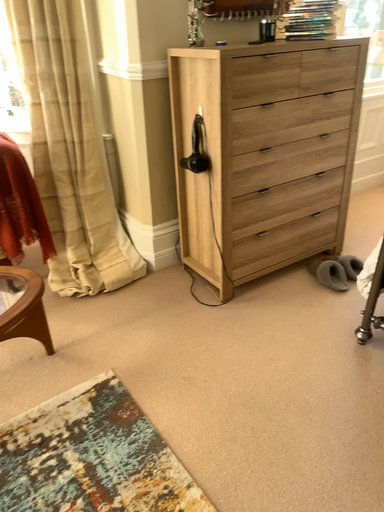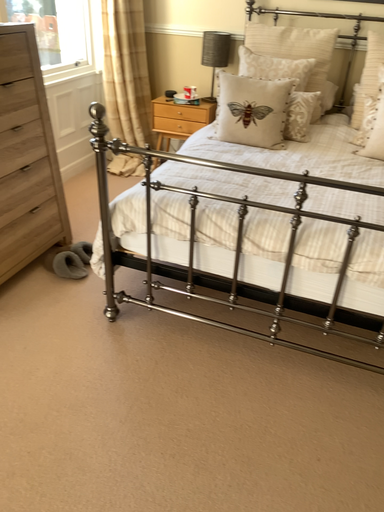
Question: Which way did the camera rotate in the video?

Choices:
 (A) rotated right
 (B) rotated left

Answer: (A)